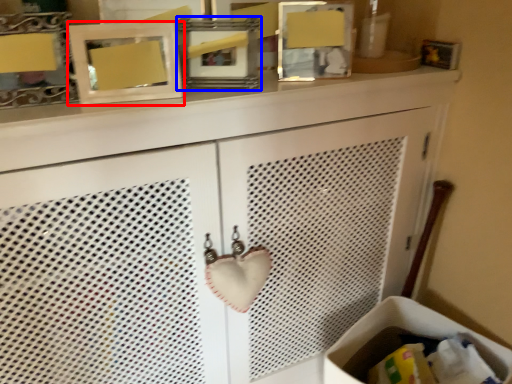
Question: Which point is closer to the camera, picture frame (highlighted by a red box) or picture frame (highlighted by a blue box)?

Choices:
 (A) picture frame
 (B) picture frame

Answer: (A)